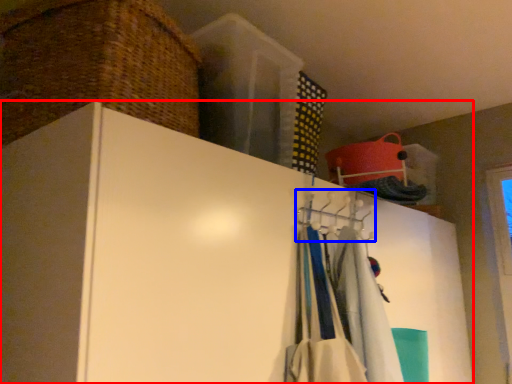
Question: Among these objects, which one is farthest to the camera, cupboard (highlighted by a red box) or hanger (highlighted by a blue box)?

Choices:
 (A) cupboard
 (B) hanger

Answer: (B)